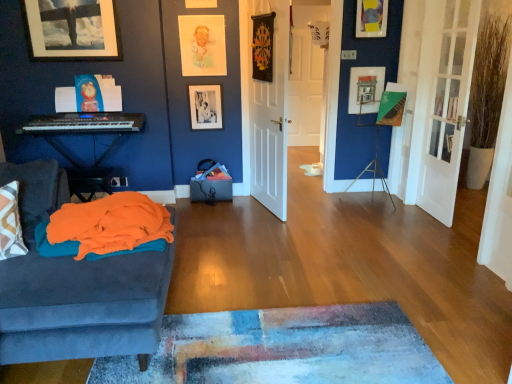
Where is `blank space situated above matte wooden picture frame at center, marked as the 5th picture frame in a left-to-right arrangement (from a real-world perspective)`? blank space situated above matte wooden picture frame at center, marked as the 5th picture frame in a left-to-right arrangement (from a real-world perspective) is located at coordinates (364, 67).